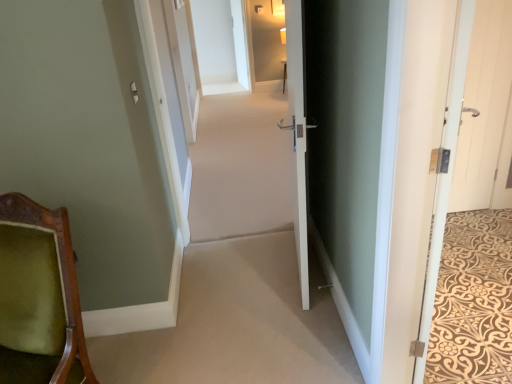
Question: From the image's perspective, is white wood door at right, the third door positioned from the right, under white wooden door at right, the second door from the right?

Choices:
 (A) yes
 (B) no

Answer: (A)

Question: Is white wood door at right, the third door positioned from the right, at the left side of white wooden door at right, the 3th door positioned from the left?

Choices:
 (A) yes
 (B) no

Answer: (A)

Question: From the image's perspective, is white wood door at right, the third door positioned from the right, on white wooden door at right, the second door from the right?

Choices:
 (A) yes
 (B) no

Answer: (B)

Question: Is white wood door at right, which is the 2th door in left-to-right order, further to camera compared to white wooden door at right, the second door from the right?

Choices:
 (A) yes
 (B) no

Answer: (B)

Question: From a real-world perspective, is white wood door at right, which is the 2th door in left-to-right order, beneath white wooden door at right, the second door from the right?

Choices:
 (A) no
 (B) yes

Answer: (A)

Question: From the image's perspective, is white wooden door at right, the second door from the right, located above or below white wood door at right, which is the 2th door in left-to-right order?

Choices:
 (A) above
 (B) below

Answer: (A)

Question: Is white wooden door at right, the 3th door positioned from the left, inside the boundaries of white wood door at right, which is the 2th door in left-to-right order, or outside?

Choices:
 (A) outside
 (B) inside

Answer: (A)

Question: From a real-world perspective, relative to white wood door at right, which is the 2th door in left-to-right order, is white wooden door at right, the second door from the right, vertically above or below?

Choices:
 (A) above
 (B) below

Answer: (B)

Question: Considering the positions of point (406, 230) and point (479, 97), is point (406, 230) closer or farther from the camera than point (479, 97)?

Choices:
 (A) farther
 (B) closer

Answer: (B)

Question: Considering the positions of white wooden door at right, the 3th door positioned from the left, and beige carpet at center in the image, is white wooden door at right, the 3th door positioned from the left, taller or shorter than beige carpet at center?

Choices:
 (A) tall
 (B) short

Answer: (B)

Question: Is point (437, 140) closer or farther from the camera than point (220, 155)?

Choices:
 (A) closer
 (B) farther

Answer: (A)

Question: Would you say white wooden door at right, the second door from the right, is inside or outside beige carpet at center?

Choices:
 (A) inside
 (B) outside

Answer: (B)

Question: Is white wooden door at right, the 3th door positioned from the left, wider or thinner than beige carpet at center?

Choices:
 (A) thin
 (B) wide

Answer: (A)

Question: From a real-world perspective, is white glossy door at center, which appears as the 1th door when viewed from the left, above or below green velvet chair at lower left?

Choices:
 (A) above
 (B) below

Answer: (A)

Question: Considering the positions of white glossy door at center, which appears as the 1th door when viewed from the left, and green velvet chair at lower left in the image, is white glossy door at center, which appears as the 1th door when viewed from the left, taller or shorter than green velvet chair at lower left?

Choices:
 (A) tall
 (B) short

Answer: (A)